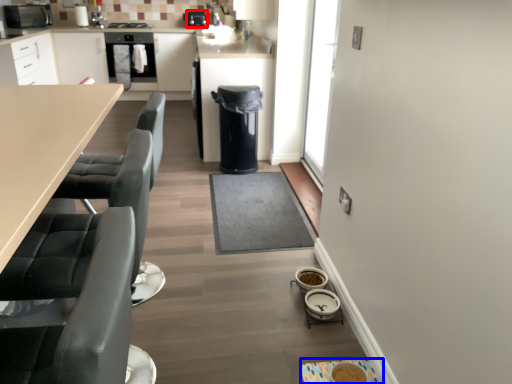
Question: Which object appears farthest to the camera in this image, appliance (highlighted by a red box) or appliance (highlighted by a blue box)?

Choices:
 (A) appliance
 (B) appliance

Answer: (A)